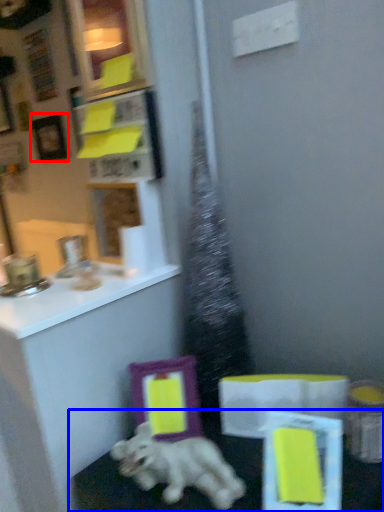
Question: Which of the following is the farthest to the observer, picture frame (highlighted by a red box) or table (highlighted by a blue box)?

Choices:
 (A) picture frame
 (B) table

Answer: (A)